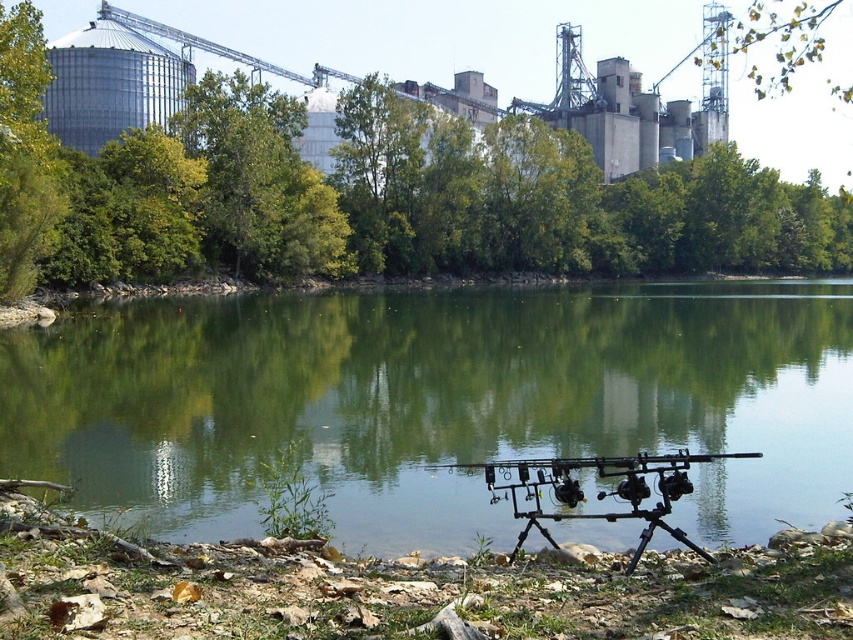
Question: Does black matte tripod at center have a smaller size compared to green leafy tree at upper center?

Choices:
 (A) no
 (B) yes

Answer: (B)

Question: Does green leafy tree at center have a lesser width compared to green leafy tree at upper center?

Choices:
 (A) yes
 (B) no

Answer: (B)

Question: Is green smooth water at center above green leafy tree at center?

Choices:
 (A) no
 (B) yes

Answer: (A)

Question: Which of the following is the farthest from the observer?

Choices:
 (A) green leafy tree at upper center
 (B) black matte tripod at center
 (C) green leafy tree at center
 (D) green smooth water at center

Answer: (A)

Question: Which point appears farthest from the camera in this image?

Choices:
 (A) (300, 228)
 (B) (773, 26)

Answer: (B)

Question: Which of these objects is positioned closest to the black matte tripod at center?

Choices:
 (A) green leafy tree at upper center
 (B) green smooth water at center

Answer: (B)